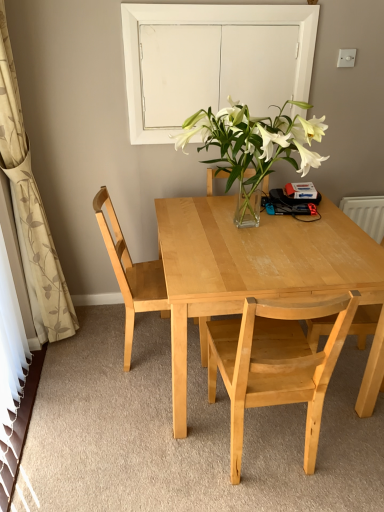
Where is `space that is in front of light wood chair at left, which ranks as the 1th chair in left-to-right order`? space that is in front of light wood chair at left, which ranks as the 1th chair in left-to-right order is located at coordinates (131, 403).